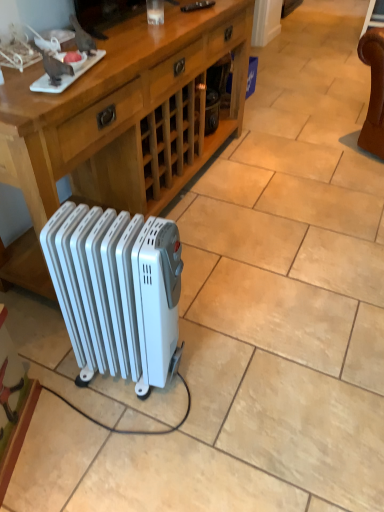
Question: From a real-world perspective, does wooden desk at center sit lower than white plastic radiator at lower center?

Choices:
 (A) yes
 (B) no

Answer: (B)

Question: Is wooden desk at center completely or partially outside of white plastic radiator at lower center?

Choices:
 (A) no
 (B) yes

Answer: (B)

Question: Is the depth of wooden desk at center greater than that of white plastic radiator at lower center?

Choices:
 (A) no
 (B) yes

Answer: (B)

Question: Can you confirm if wooden desk at center is positioned to the right of white plastic radiator at lower center?

Choices:
 (A) yes
 (B) no

Answer: (B)

Question: Would you say white plastic radiator at lower center is part of wooden desk at center's contents?

Choices:
 (A) yes
 (B) no

Answer: (B)

Question: Is wooden desk at center oriented towards white plastic radiator at lower center?

Choices:
 (A) yes
 (B) no

Answer: (A)

Question: Does white plastic radiator at lower center have a larger size compared to wooden desk at center?

Choices:
 (A) yes
 (B) no

Answer: (B)

Question: Does white plastic radiator at lower center appear on the right side of wooden desk at center?

Choices:
 (A) yes
 (B) no

Answer: (A)

Question: Does white plastic radiator at lower center have a lesser width compared to wooden desk at center?

Choices:
 (A) yes
 (B) no

Answer: (A)

Question: Is white plastic radiator at lower center next to wooden desk at center and touching it?

Choices:
 (A) yes
 (B) no

Answer: (B)

Question: Can you confirm if white plastic radiator at lower center is taller than wooden desk at center?

Choices:
 (A) yes
 (B) no

Answer: (B)

Question: Is white plastic radiator at lower center positioned behind wooden desk at center?

Choices:
 (A) yes
 (B) no

Answer: (B)

Question: Based on their sizes in the image, would you say wooden desk at center is bigger or smaller than white plastic radiator at lower center?

Choices:
 (A) big
 (B) small

Answer: (A)